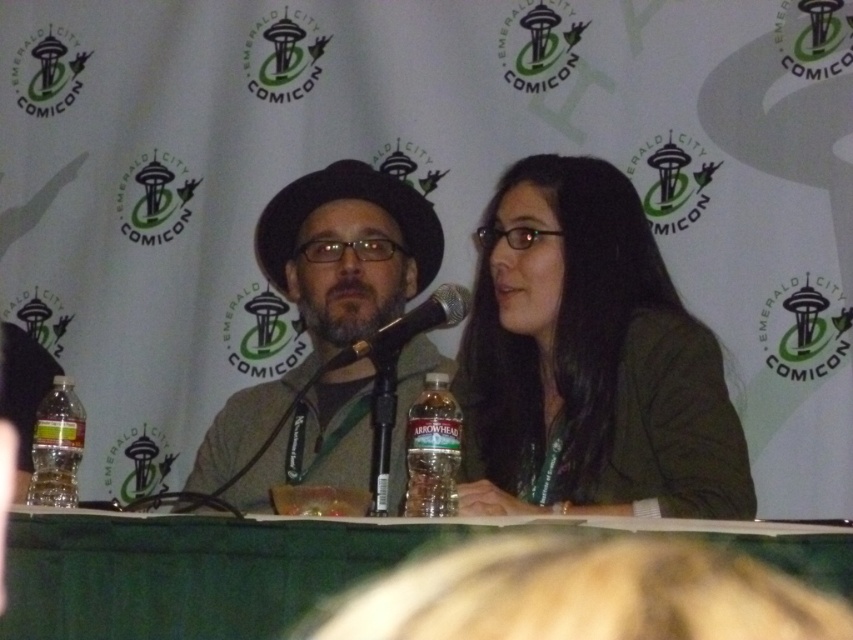
Question: Which point appears farthest from the camera in this image?

Choices:
 (A) (96, 518)
 (B) (334, 216)
 (C) (62, 419)

Answer: (B)

Question: Can you confirm if matte brown hat at center is positioned above clear plastic bottle at lower left?

Choices:
 (A) yes
 (B) no

Answer: (A)

Question: Can you confirm if green fabric table at center is bigger than matte brown hat at center?

Choices:
 (A) no
 (B) yes

Answer: (A)

Question: Considering the real-world distances, which object is farthest from the green matte jacket at center?

Choices:
 (A) translucent plastic bottle at center
 (B) black matte microphone at center
 (C) green fabric table at center

Answer: (C)

Question: Which of the following is the farthest from the observer?

Choices:
 (A) (405, 321)
 (B) (566, 442)
 (C) (68, 440)
 (D) (428, 396)

Answer: (B)

Question: Is green matte jacket at center further to camera compared to matte brown hat at center?

Choices:
 (A) no
 (B) yes

Answer: (A)